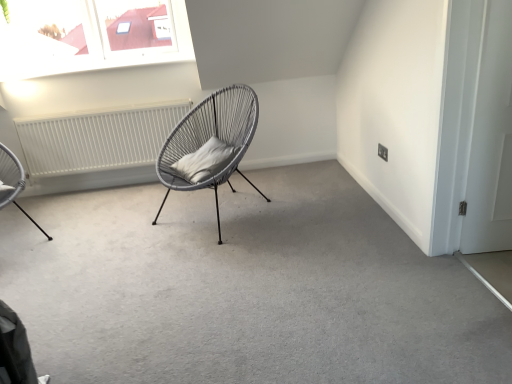
I want to click on vacant space positioned to the left of matte grey wicker chair at center, which appears as the 2th chair when viewed from the left, so click(115, 226).